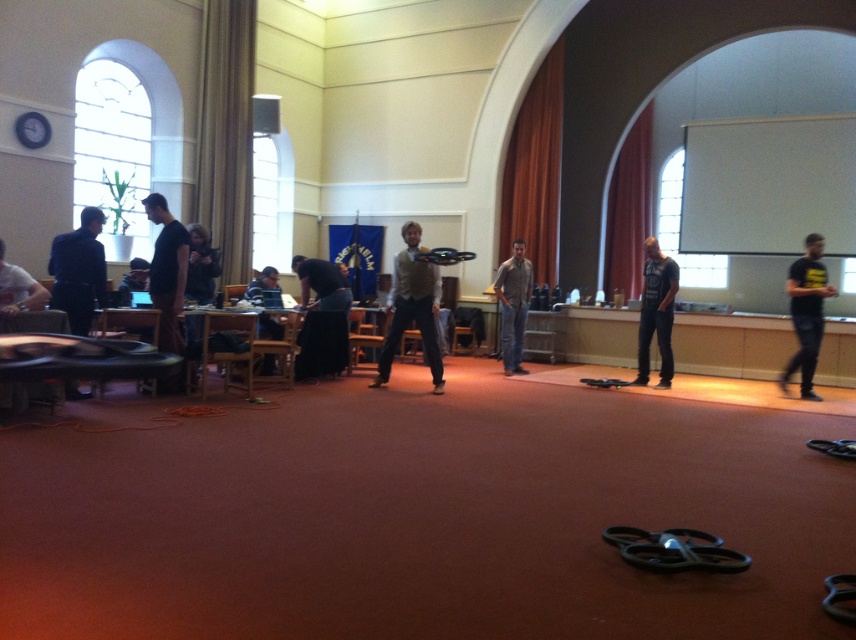
Question: Which object is the closest to the light brown leather vest at center?

Choices:
 (A) black t-shirt at right
 (B) dark blue jeans at center

Answer: (B)

Question: Does black t-shirt at right have a greater width compared to black cotton t-shirt at center?

Choices:
 (A) no
 (B) yes

Answer: (B)

Question: Where is light brown leather vest at center located in relation to gray cotton shirt at center in the image?

Choices:
 (A) below
 (B) above

Answer: (A)

Question: Which of the following is the closest to the observer?

Choices:
 (A) black cotton t-shirt at center
 (B) dark brown leather jacket at center

Answer: (B)

Question: Among these objects, which one is nearest to the camera?

Choices:
 (A) dark blue shirt at center
 (B) dark brown leather jacket at center
 (C) black cotton t-shirt at center

Answer: (B)

Question: Is black cotton t-shirt at center bigger than gray cotton shirt at center?

Choices:
 (A) no
 (B) yes

Answer: (A)